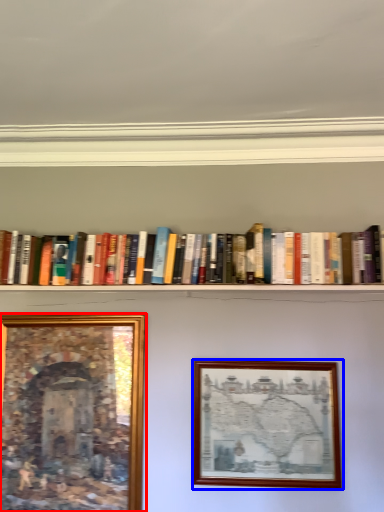
Question: Which object is closer to the camera taking this photo, picture frame (highlighted by a red box) or picture frame (highlighted by a blue box)?

Choices:
 (A) picture frame
 (B) picture frame

Answer: (B)